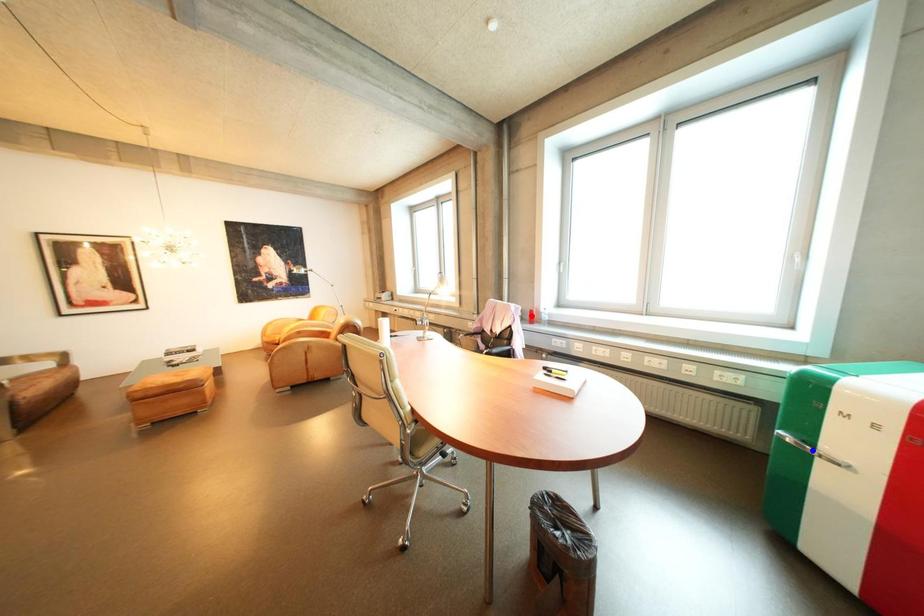
Question: Two points are marked on the image. Which point is closer to the camera?

Choices:
 (A) Blue point is closer.
 (B) Red point is closer.

Answer: (A)